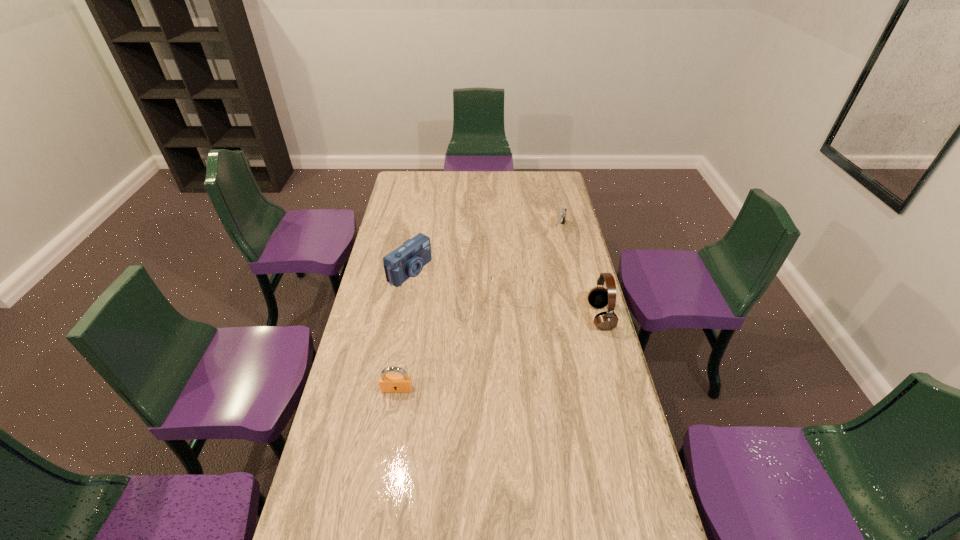
Find the location of a particular element. This screenshot has width=960, height=540. free space that satisfies the following two spatial constraints: 1. on the front side of the camera; 2. on the ear pads of the tallest object is located at coordinates (401, 317).

Identify the location of vacant region that satisfies the following two spatial constraints: 1. on the front side of the camera; 2. on the ear pads of the tallest object. (401, 317).

Identify the location of free space that satisfies the following two spatial constraints: 1. on the front side of the spectacles; 2. on the left side of the camera. The height and width of the screenshot is (540, 960). [x=406, y=292].

The image size is (960, 540). What are the coordinates of `vacant position in the image that satisfies the following two spatial constraints: 1. on the front side of the camera; 2. on the left side of the third object from right to left` in the screenshot? It's located at (406, 292).